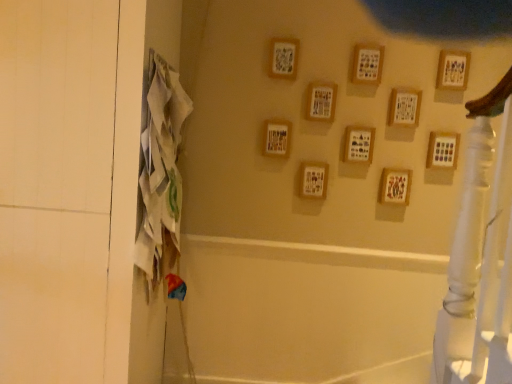
Locate an element on the screen. This screenshot has height=384, width=512. wooden picture frame at center, which is counted as the 4th picture frame, starting from the left is located at coordinates (321, 101).

At what (x,y) coordinates should I click in order to perform the action: click on white fabric screen door at left. Please return your answer as a coordinate pair (x, y). The width and height of the screenshot is (512, 384). Looking at the image, I should click on (68, 187).

In order to face wooden picture frame at upper center, which is the 8th picture frame in left-to-right order, should I rotate leftwards or rightwards?

Rotate right and turn 19.351 degrees.

What do you see at coordinates (404, 107) in the screenshot? I see `wooden picture frame at upper center, arranged as the 3th picture frame when viewed from the right` at bounding box center [404, 107].

I want to click on wooden picture frame at upper center, which is the 6th picture frame in left-to-right order, so click(x=367, y=64).

In order to face wooden frame at upper center, arranged as the 9th picture frame when viewed from the right, should I rotate leftwards or rightwards?

To align with it, rotate right about 3.760°.

I want to click on wooden frame at center-right, which ranks as the 4th picture frame in right-to-left order, so click(x=395, y=186).

Does white fabric screen door at left have a larger size compared to wooden picture frame at upper center, which is the 6th picture frame in left-to-right order?

Correct, white fabric screen door at left is larger in size than wooden picture frame at upper center, which is the 6th picture frame in left-to-right order.

How distant is white fabric screen door at left from wooden picture frame at upper center, which is the 6th picture frame in left-to-right order?

white fabric screen door at left is 1.54 meters away from wooden picture frame at upper center, which is the 6th picture frame in left-to-right order.

From a real-world perspective, who is located higher, white fabric screen door at left or wooden picture frame at upper center, which is the 6th picture frame in left-to-right order?

In real-world perspective, wooden picture frame at upper center, which is the 6th picture frame in left-to-right order, is above.

What's the angular difference between white fabric screen door at left and wooden picture frame at upper center, marked as the fifth picture frame in a right-to-left arrangement,'s facing directions?

They differ by 1.86 degrees in their facing directions.

Would you say wooden frame at center, the third picture frame when ordered from left to right, contains wooden picture frame at upper center, which is the 8th picture frame in left-to-right order?

No, wooden frame at center, the third picture frame when ordered from left to right, does not contain wooden picture frame at upper center, which is the 8th picture frame in left-to-right order.

Which of these two, wooden frame at center, which appears as the 8th picture frame when viewed from the right, or wooden picture frame at upper center, arranged as the 3th picture frame when viewed from the right, is bigger?

Bigger between the two is wooden picture frame at upper center, arranged as the 3th picture frame when viewed from the right.

Between wooden frame at center, the third picture frame when ordered from left to right, and wooden picture frame at upper center, which is the 8th picture frame in left-to-right order, which one appears on the right side from the viewer's perspective?

wooden picture frame at upper center, which is the 8th picture frame in left-to-right order.

You are a GUI agent. You are given a task and a screenshot of the screen. Output one action in this format:
    pyautogui.click(x=<x>, y=<y>)
    Task: Click on the 5th picture frame below the wooden picture frame at upper center, which is the 8th picture frame in left-to-right order (from a real-world perspective)
    
    Given the screenshot: What is the action you would take?
    pyautogui.click(x=313, y=180)

Based on the photo, from a real-world perspective, who is located higher, white fabric screen door at left or wooden picture frame at center, which is counted as the 4th picture frame, starting from the left?

In real-world perspective, wooden picture frame at center, which is counted as the 4th picture frame, starting from the left, is above.

Considering the relative sizes of white fabric screen door at left and wooden picture frame at center, which is counted as the 4th picture frame, starting from the left, in the image provided, is white fabric screen door at left bigger than wooden picture frame at center, which is counted as the 4th picture frame, starting from the left,?

Yes.

Is white fabric screen door at left aimed at wooden picture frame at center, which is the 7th picture frame in right-to-left order?

No, white fabric screen door at left does not turn towards wooden picture frame at center, which is the 7th picture frame in right-to-left order.

How much distance is there between wooden picture frame at upper center, which is the 6th picture frame in left-to-right order, and wooden picture frame at upper center, arranged as the 3th picture frame when viewed from the right?

wooden picture frame at upper center, which is the 6th picture frame in left-to-right order, and wooden picture frame at upper center, arranged as the 3th picture frame when viewed from the right, are 20.91 centimeters apart from each other.

Considering the sizes of objects wooden picture frame at upper center, which is the 6th picture frame in left-to-right order, and wooden picture frame at upper center, which is the 8th picture frame in left-to-right order, in the image provided, who is thinner, wooden picture frame at upper center, which is the 6th picture frame in left-to-right order, or wooden picture frame at upper center, which is the 8th picture frame in left-to-right order,?

Thinner between the two is wooden picture frame at upper center, which is the 6th picture frame in left-to-right order.

Image resolution: width=512 pixels, height=384 pixels. I want to click on picture frame that is the 2nd one when counting forward from the wooden picture frame at upper center, which is the 8th picture frame in left-to-right order, so click(367, 64).

Looking at this image, considering their positions, is wooden picture frame at upper center, which is the 6th picture frame in left-to-right order, located in front of or behind wooden picture frame at upper center, arranged as the 3th picture frame when viewed from the right?

wooden picture frame at upper center, which is the 6th picture frame in left-to-right order, is positioned closer to the viewer than wooden picture frame at upper center, arranged as the 3th picture frame when viewed from the right.

Is point (271, 134) closer or farther from the camera than point (9, 5)?

Point (271, 134) is positioned farther from the camera compared to point (9, 5).

Is wooden frame at center, acting as the first picture frame starting from the left, to the left of white fabric screen door at left from the viewer's perspective?

In fact, wooden frame at center, acting as the first picture frame starting from the left, is to the right of white fabric screen door at left.

From the image's perspective, does wooden frame at center, which appears as the tenth picture frame when viewed from the right, appear higher than white fabric screen door at left?

Yes.

Considering the relative positions of wooden frame at center, which appears as the tenth picture frame when viewed from the right, and white fabric screen door at left in the image provided, is wooden frame at center, which appears as the tenth picture frame when viewed from the right, behind white fabric screen door at left?

That is True.

From the wooden picture frame at center, which is counted as the 4th picture frame, starting from the left, count 3rd picture frame to the right and point to it. Please provide its 2D coordinates.

[(395, 186)]

Is wooden frame at center-right, the 7th picture frame from the left, at the right side of wooden picture frame at center, which is the 7th picture frame in right-to-left order?

Yes, wooden frame at center-right, the 7th picture frame from the left, is to the right of wooden picture frame at center, which is the 7th picture frame in right-to-left order.

Do you think wooden frame at center-right, which ranks as the 4th picture frame in right-to-left order, is within wooden picture frame at center, which is the 7th picture frame in right-to-left order, or outside of it?

wooden frame at center-right, which ranks as the 4th picture frame in right-to-left order, is located beyond the bounds of wooden picture frame at center, which is the 7th picture frame in right-to-left order.

Does point (406, 204) appear closer or farther from the camera than point (319, 98)?

Point (406, 204).

Can you see white fabric screen door at left touching wooden frame at center, acting as the first picture frame starting from the left?

They are not placed beside each other.

I want to click on screen door that is below the wooden frame at center, acting as the first picture frame starting from the left (from the image's perspective), so click(68, 187).

Which object is wider, white fabric screen door at left or wooden frame at center, acting as the first picture frame starting from the left?

white fabric screen door at left.

From the picture: Is white fabric screen door at left closer to camera compared to wooden frame at center, which appears as the tenth picture frame when viewed from the right?

Yes, white fabric screen door at left is in front of wooden frame at center, which appears as the tenth picture frame when viewed from the right.

I want to click on the 2nd picture frame behind the white fabric screen door at left, so click(367, 64).

This screenshot has width=512, height=384. What are the coordinates of `the 5th picture frame below the wooden picture frame at upper center, arranged as the 3th picture frame when viewed from the right (from a real-world perspective)` in the screenshot? It's located at (313, 180).

From the image, which object appears to be nearer to wooden picture frame at center, which is counted as the 4th picture frame, starting from the left, white fabric screen door at left or wooden picture frame at center, the fifth picture frame in the left-to-right sequence?

wooden picture frame at center, the fifth picture frame in the left-to-right sequence, is positioned closer to the anchor wooden picture frame at center, which is counted as the 4th picture frame, starting from the left.

Which object lies further to the anchor point wooden frame at center, which appears as the 8th picture frame when viewed from the right, wooden picture frame at right, the ninth picture frame in the left-to-right sequence, or wooden frame at center, which appears as the tenth picture frame when viewed from the right?

Based on the image, wooden picture frame at right, the ninth picture frame in the left-to-right sequence, appears to be further to wooden frame at center, which appears as the 8th picture frame when viewed from the right.

Which object lies nearer to the anchor point wooden picture frame at upper center, which is the 6th picture frame in left-to-right order, wooden picture frame at center, the fifth picture frame in the left-to-right sequence, or wooden picture frame at upper center, arranged as the 3th picture frame when viewed from the right?

Based on the image, wooden picture frame at upper center, arranged as the 3th picture frame when viewed from the right, appears to be nearer to wooden picture frame at upper center, which is the 6th picture frame in left-to-right order.

Considering their positions, is wooden picture frame at upper center, marked as the fifth picture frame in a right-to-left arrangement, positioned closer to white fabric screen door at left than wooden frame at upper center, arranged as the 9th picture frame when viewed from the right?

The object closer to white fabric screen door at left is wooden frame at upper center, arranged as the 9th picture frame when viewed from the right.

Based on the photo, estimate the real-world distances between objects in this image. Which object is closer to wooden picture frame at right, the ninth picture frame in the left-to-right sequence, wooden frame at center, acting as the first picture frame starting from the left, or wooden frame at center, which appears as the 8th picture frame when viewed from the right?

The object closer to wooden picture frame at right, the ninth picture frame in the left-to-right sequence, is wooden frame at center, which appears as the 8th picture frame when viewed from the right.

Which object lies nearer to the anchor point wooden picture frame at upper right, the first picture frame viewed from the right, wooden frame at center, which appears as the 8th picture frame when viewed from the right, or wooden picture frame at upper center, which is the 6th picture frame in left-to-right order?

Among the two, wooden picture frame at upper center, which is the 6th picture frame in left-to-right order, is located nearer to wooden picture frame at upper right, the first picture frame viewed from the right.

Looking at the image, which one is located further to wooden frame at center, the third picture frame when ordered from left to right, wooden picture frame at upper center, arranged as the 3th picture frame when viewed from the right, or wooden picture frame at center, the fifth picture frame in the left-to-right sequence?

The object further to wooden frame at center, the third picture frame when ordered from left to right, is wooden picture frame at upper center, arranged as the 3th picture frame when viewed from the right.

Which object lies further to the anchor point wooden picture frame at upper right, the first picture frame viewed from the right, wooden picture frame at right, the ninth picture frame in the left-to-right sequence, or wooden picture frame at center, the fifth picture frame in the left-to-right sequence?

Based on the image, wooden picture frame at center, the fifth picture frame in the left-to-right sequence, appears to be further to wooden picture frame at upper right, the first picture frame viewed from the right.

Locate an element on the screen. The image size is (512, 384). picture frame between white fabric screen door at left and wooden frame at upper center, which is the second picture frame in left-to-right order, from left to right is located at coordinates (277, 138).